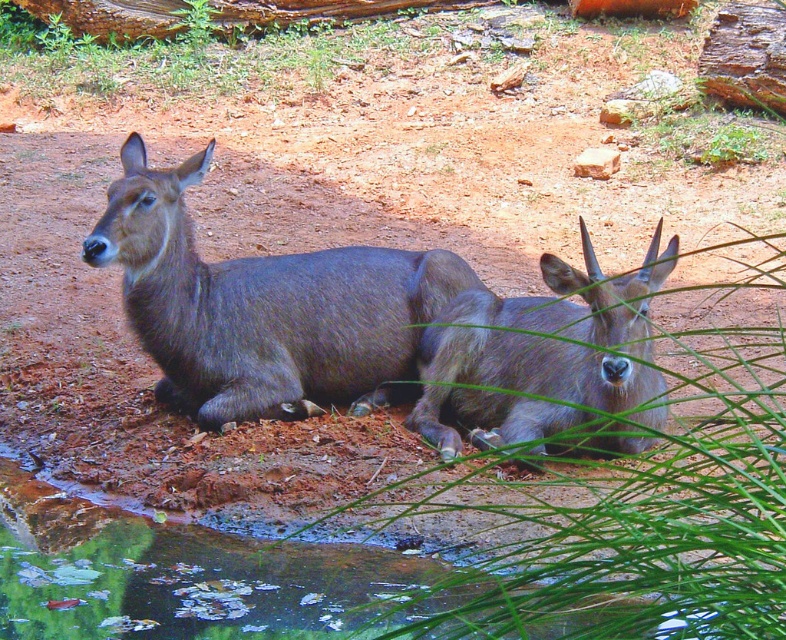
Is green leafy grass at center to the left of shiny brown deer at center from the viewer's perspective?

In fact, green leafy grass at center is to the right of shiny brown deer at center.

Measure the distance between point [597,592] and camera.

Point [597,592] is 4.35 feet from camera.

Where is `green leafy grass at center`? This screenshot has height=640, width=786. green leafy grass at center is located at coordinates (636, 513).

Who is more forward, (360,280) or (479,419)?

Positioned in front is point (479,419).

Is point (340, 284) closer to viewer compared to point (582, 417)?

No.

Between point (261, 292) and point (518, 413), which one is positioned behind?

The point (261, 292) is behind.

At what (x,y) coordinates should I click in order to perform the action: click on shiny brown deer at center. Please return your answer as a coordinate pair (x, y). The height and width of the screenshot is (640, 786). Looking at the image, I should click on (263, 307).

Is green leafy grass at center smaller than gray matte deer at center?

No.

From the picture: Who is more forward, (700, 564) or (586, 268)?

Point (700, 564) is in front.

Between point (483, 605) and point (509, 376), which one is positioned behind?

The point (509, 376) is more distant.

Identify the location of green leafy grass at center. (636, 513).